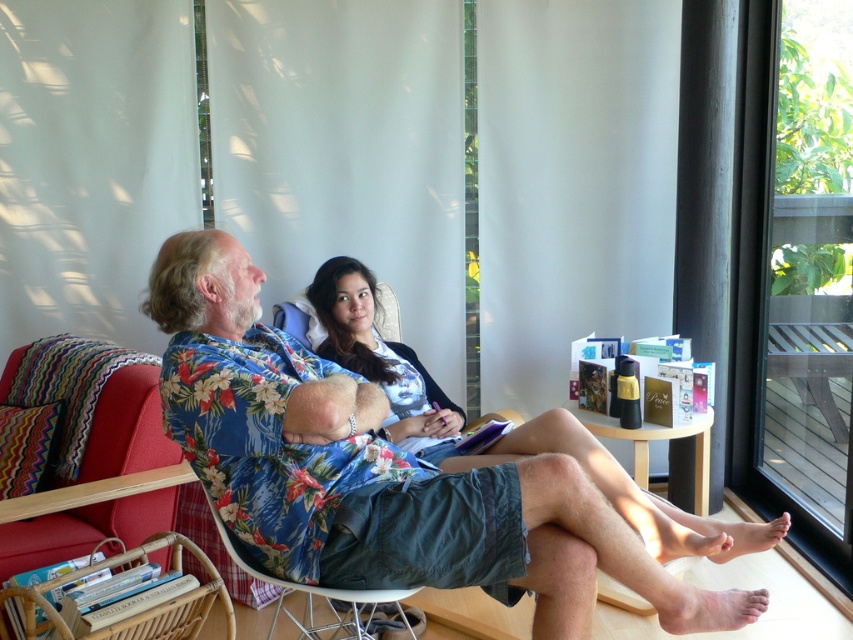
You are a delivery person arriving at this address and need to enter through the transparent glass door at right. However, there is a matte floral shirt at center blocking your path. Can you walk through the space between the two objects without bending down?

The transparent glass door at right is much taller than the matte floral shirt at center, so you can walk through the space between them without bending down as the door is significantly taller.